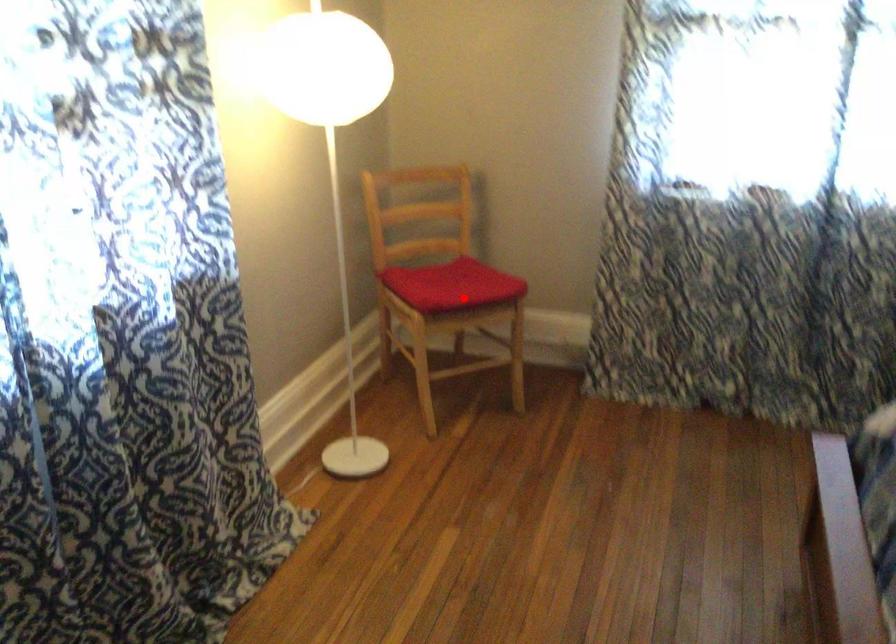
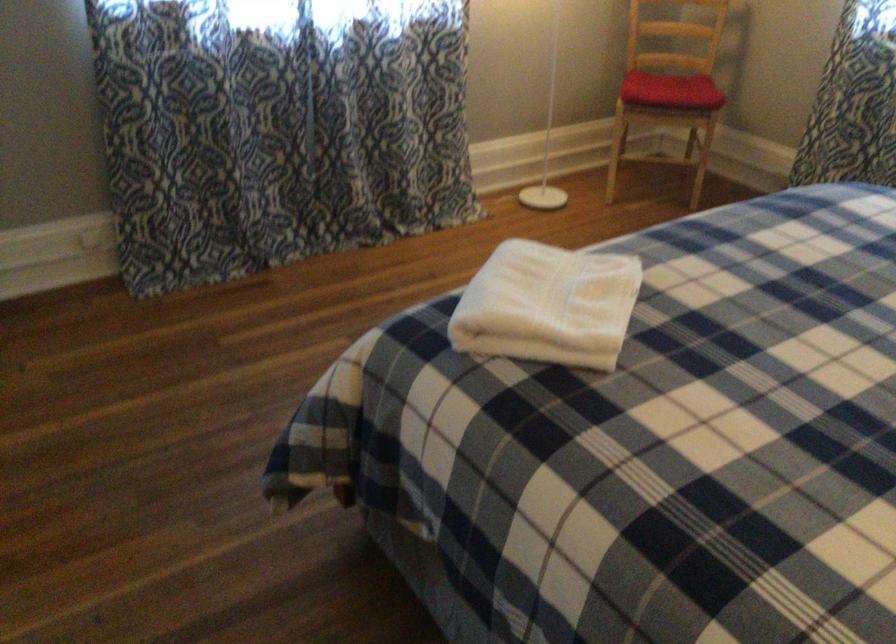
Question: I am providing you with two images of the same scene from different viewpoints. A red point is shown in image1. For the corresponding object point in image2, is it positioned nearer or farther from the camera?

Choices:
 (A) Nearer
 (B) Farther

Answer: (B)